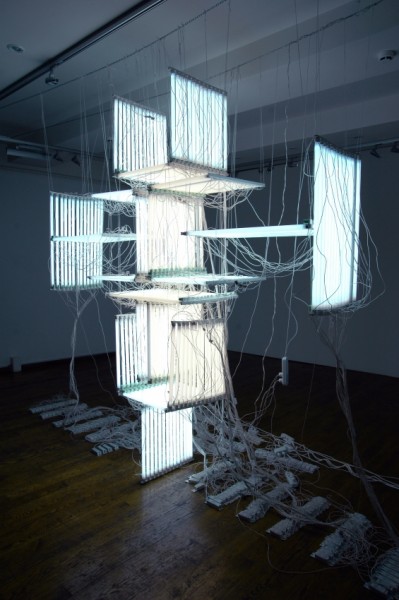
I want to click on lights, so click(x=73, y=215), click(x=149, y=341), click(x=131, y=356), click(x=181, y=368), click(x=167, y=444), click(x=324, y=216).